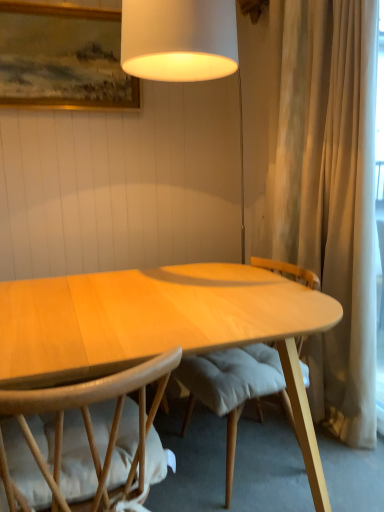
Locate an element on the screen. The width and height of the screenshot is (384, 512). vacant space underneath light wood desk at center (from a real-world perspective) is located at coordinates (261, 471).